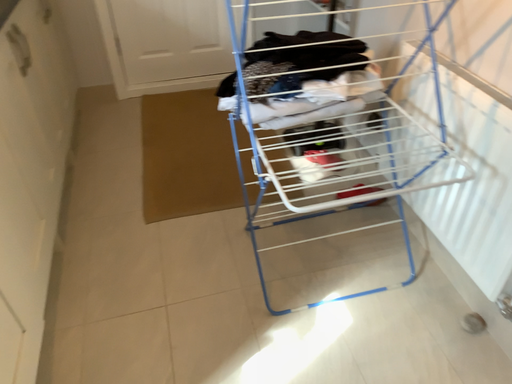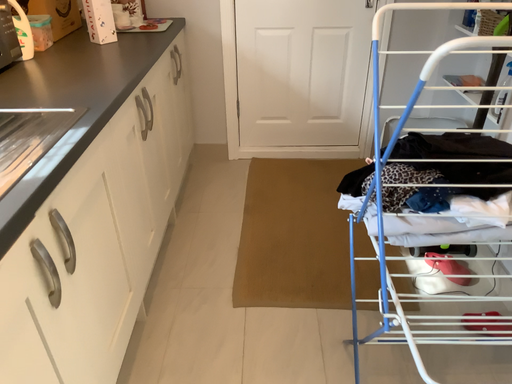
Question: Which way did the camera rotate in the video?

Choices:
 (A) rotated downward
 (B) rotated upward

Answer: (B)